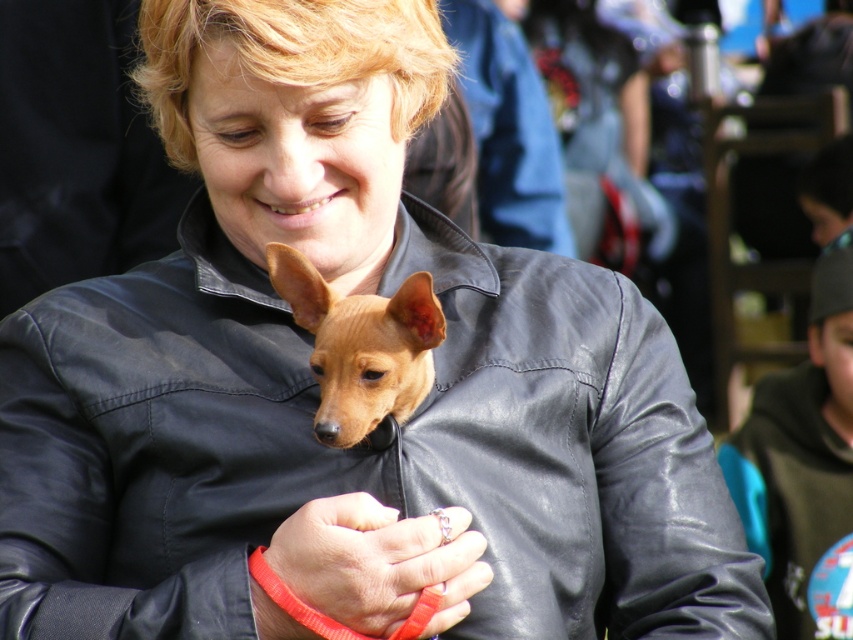
Consider the image. You are a fashion designer observing the image. You need to determine the spatial relationship between the dark green hoodie at lower right and the leather ring at center. Which object is positioned lower in the image?

The dark green hoodie at lower right is positioned below the leather ring at center, so it is lower in the image.

The woman is holding a small dog and has a ring on her finger. If you were to compare the size of the leather ring at center and the brown leather dog at center, which one is smaller?

The leather ring at center has a smaller size compared to the brown leather dog at center, so the leather ring at center is smaller.

You are a fashion designer observing the image. You need to decide which item, the dark green hoodie at lower right or the leather ring at center, can be seen from a distance. Based on their sizes, which one is more likely to be visible?

The dark green hoodie at lower right has a greater height compared to the leather ring at center, so it is more likely to be visible from a distance due to its larger size.